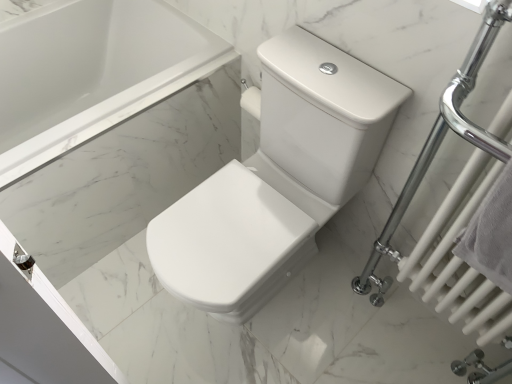
Question: In the image, is white glossy towel rack at right positioned in front of or behind white cotton towel at right?

Choices:
 (A) front
 (B) behind

Answer: (A)

Question: Is white glossy towel rack at right inside or outside of white cotton towel at right?

Choices:
 (A) outside
 (B) inside

Answer: (A)

Question: Which object is positioned farthest from the white marble bathtub at upper left?

Choices:
 (A) white glossy toilet at center
 (B) white glossy towel rack at right
 (C) white cotton towel at right

Answer: (C)

Question: Which of these objects is positioned farthest from the white marble bathtub at upper left?

Choices:
 (A) white glossy toilet at center
 (B) white glossy towel rack at right
 (C) white cotton towel at right

Answer: (C)